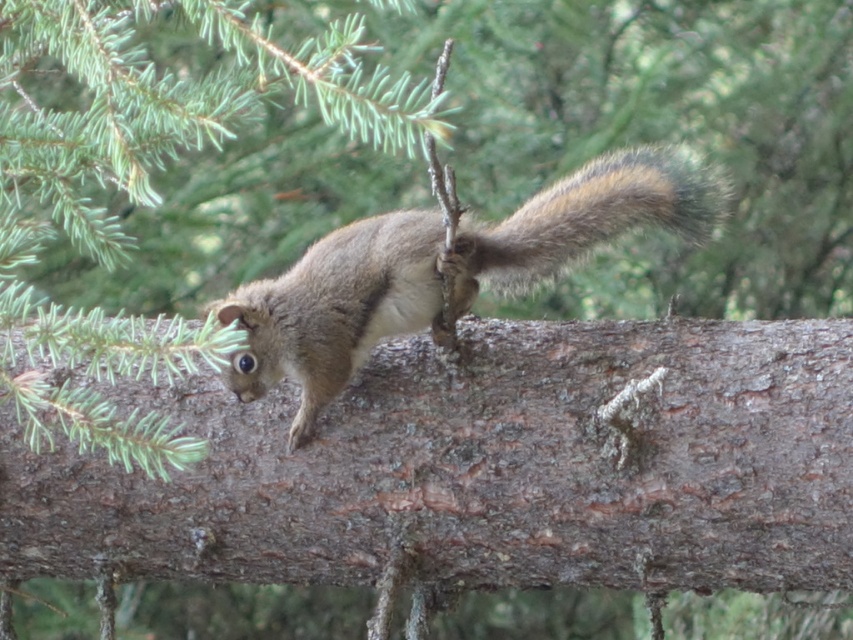
Who is positioned more to the right, brown fur squirrel at center or fuzzy brown tail at center?

From the viewer's perspective, fuzzy brown tail at center appears more on the right side.

Is point (495, 256) behind point (693, 157)?

No.

Locate an element on the screen. This screenshot has height=640, width=853. brown fur squirrel at center is located at coordinates (444, 269).